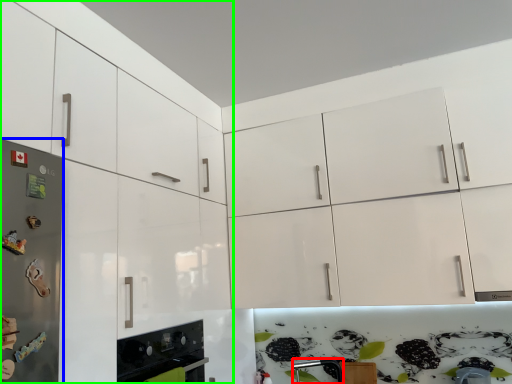
Question: Based on their relative distances, which object is nearer to silver (highlighted by a red box)? Choose from fridge (highlighted by a blue box) and cabinetry (highlighted by a green box).

Choices:
 (A) fridge
 (B) cabinetry

Answer: (B)